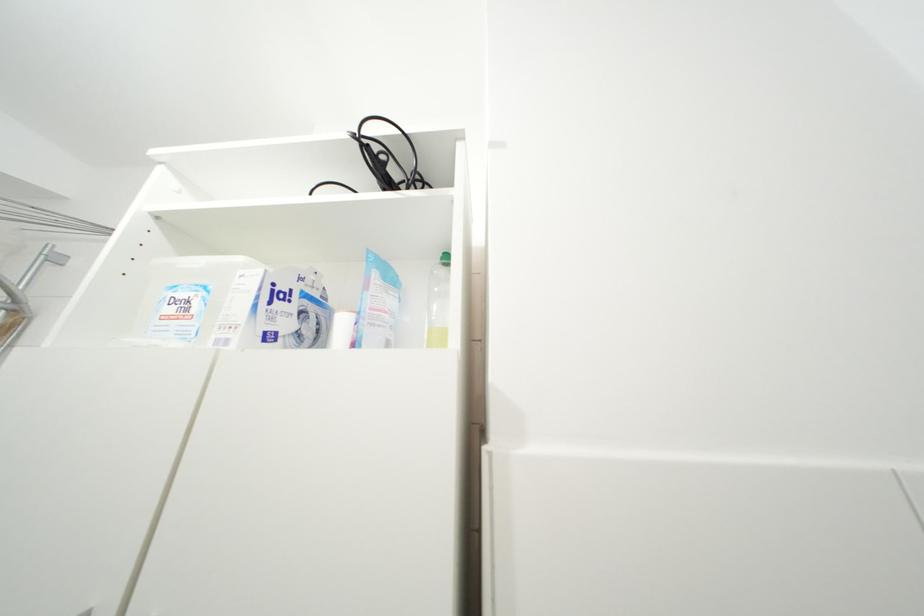
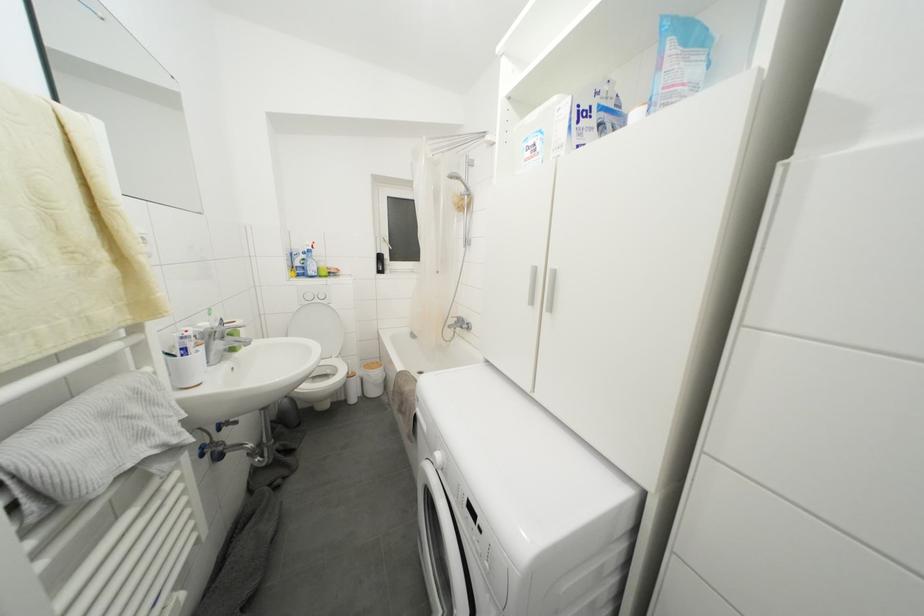
The first image is from the beginning of the video and the second image is from the end. How did the camera likely rotate when shooting the video?

The camera's rotation is toward left-down.